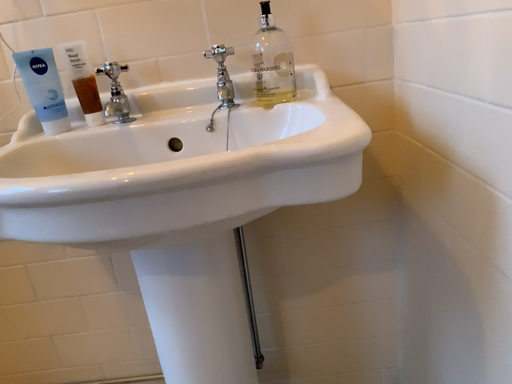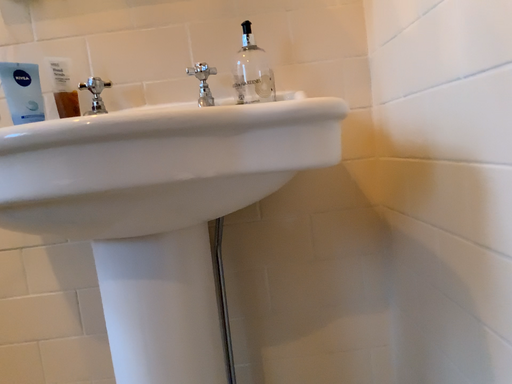
Question: How did the camera likely rotate when shooting the video?

Choices:
 (A) rotated downward
 (B) rotated upward

Answer: (B)